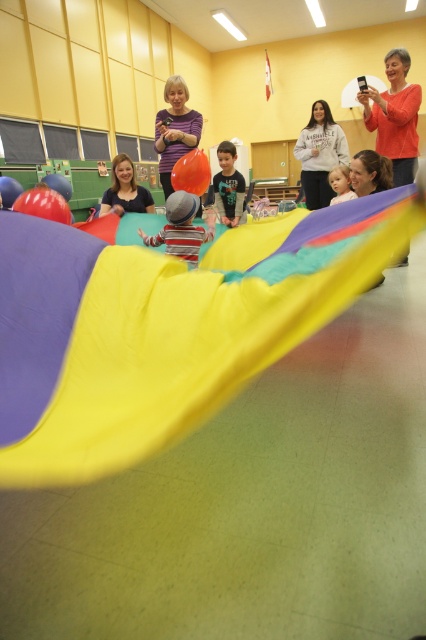
Can you confirm if matte black shirt at center is positioned to the left of rubberized orange balloon at center?

No, matte black shirt at center is not to the left of rubberized orange balloon at center.

The height and width of the screenshot is (640, 426). Identify the location of matte black shirt at center. (124, 189).

At what (x,y) coordinates should I click in order to perform the action: click on matte black shirt at center. Please return your answer as a coordinate pair (x, y). Looking at the image, I should click on (124, 189).

Can you confirm if white fleece sweatshirt at center is shorter than rubber balloon at center?

Incorrect, white fleece sweatshirt at center's height does not fall short of rubber balloon at center's.

What do you see at coordinates (319, 154) in the screenshot? I see `white fleece sweatshirt at center` at bounding box center [319, 154].

This screenshot has width=426, height=640. Identify the location of white fleece sweatshirt at center. (319, 154).

Is white fleece sweatshirt at center further to camera compared to matte yellow shirt at center?

Yes.

Can you confirm if white fleece sweatshirt at center is taller than matte yellow shirt at center?

Yes, white fleece sweatshirt at center is taller than matte yellow shirt at center.

I want to click on white fleece sweatshirt at center, so click(319, 154).

At what (x,y) coordinates should I click in order to perform the action: click on white fleece sweatshirt at center. Please return your answer as a coordinate pair (x, y). This screenshot has height=640, width=426. Looking at the image, I should click on (319, 154).